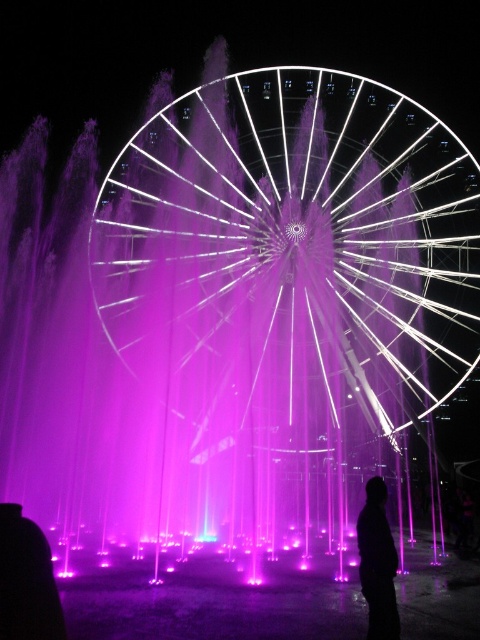
You are standing in front of the Ferris wheel and want to take a photo of both the point at coordinates point (287, 176) and point (372, 481). Which point should you focus on first to ensure both are in focus?

You should focus on point (287, 176) first because it is closer to the camera than point (372, 481). By focusing on the closer point, the farther point will also be within the depth of field, ensuring both are in focus.

You are standing at the entrance of the amusement park and want to take a photo of the white metallic ferris wheel at center and the black matte silhouette at lower right. Which object should you focus on first if you want to include both in your frame without moving the camera?

The white metallic ferris wheel at center is wider than the black matte silhouette at lower right, so you should focus on the white metallic ferris wheel at center first to ensure it fits in the frame before adjusting for the smaller silhouette.

You are planning to install a new pathway between the white metallic ferris wheel at center and the black matte silhouette at lower right. The pathway requires a minimum of 150 feet of space. Based on the scene, will there be enough space for the pathway?

The distance between the white metallic ferris wheel at center and the black matte silhouette at lower right is 158.79 feet, which exceeds the required 150 feet. Therefore, there is sufficient space to install the pathway.